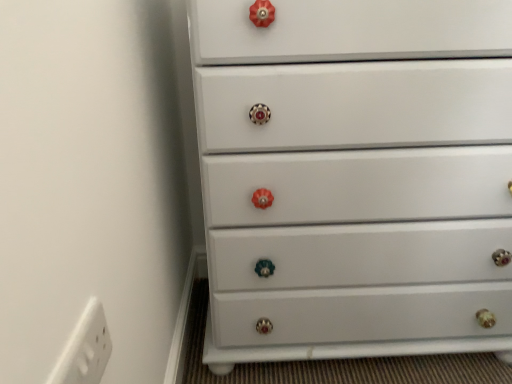
Question: From a real-world perspective, is white plastic outlet at lower left on white glossy chest of drawers at center?

Choices:
 (A) yes
 (B) no

Answer: (A)

Question: Is white plastic outlet at lower left facing away from white glossy chest of drawers at center?

Choices:
 (A) no
 (B) yes

Answer: (A)

Question: Is white plastic outlet at lower left beside white glossy chest of drawers at center?

Choices:
 (A) yes
 (B) no

Answer: (B)

Question: Can you confirm if white plastic outlet at lower left is smaller than white glossy chest of drawers at center?

Choices:
 (A) yes
 (B) no

Answer: (A)

Question: Is white plastic outlet at lower left outside white glossy chest of drawers at center?

Choices:
 (A) no
 (B) yes

Answer: (B)

Question: Is white plastic outlet at lower left at the right side of white glossy chest of drawers at center?

Choices:
 (A) no
 (B) yes

Answer: (A)

Question: Does white glossy chest of drawers at center lie behind white plastic outlet at lower left?

Choices:
 (A) no
 (B) yes

Answer: (B)

Question: Is white glossy chest of drawers at center looking in the opposite direction of white plastic outlet at lower left?

Choices:
 (A) no
 (B) yes

Answer: (A)

Question: Can you confirm if white glossy chest of drawers at center is bigger than white plastic outlet at lower left?

Choices:
 (A) no
 (B) yes

Answer: (B)

Question: Does white glossy chest of drawers at center contain white plastic outlet at lower left?

Choices:
 (A) no
 (B) yes

Answer: (A)

Question: Would you say white glossy chest of drawers at center is a long distance from white plastic outlet at lower left?

Choices:
 (A) yes
 (B) no

Answer: (B)

Question: Is white glossy chest of drawers at center to the right of white plastic outlet at lower left from the viewer's perspective?

Choices:
 (A) no
 (B) yes

Answer: (B)

Question: In terms of width, does white glossy chest of drawers at center look wider or thinner when compared to white plastic outlet at lower left?

Choices:
 (A) thin
 (B) wide

Answer: (B)